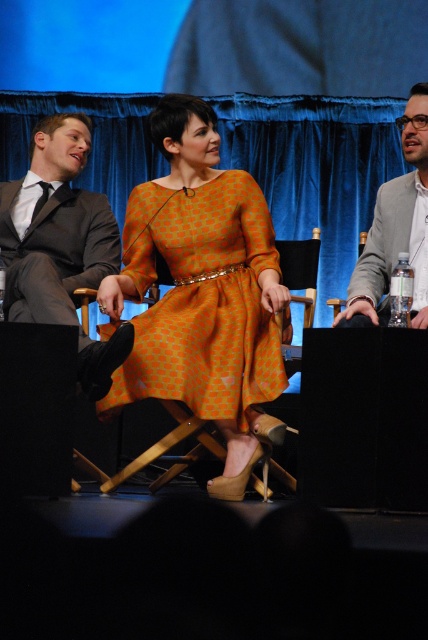
You are an event photographer trying to capture a candid shot of the dark gray suit at left without including the blue velvet curtain at upper center. Is there a way to angle your camera to achieve this?

The blue velvet curtain at upper center is positioned over the dark gray suit at left, so angling the camera downward might allow you to frame the shot to exclude the curtain while focusing on the dark gray suit at left.

You are attending a panel discussion and need to determine the spatial arrangement of the speakers based on their clothing. Which clothing item is positioned higher in the image, the orange printed dress at center or the dark gray suit at left?

The orange printed dress at center is taller than the dark gray suit at left, so the orange printed dress at center is positioned higher in the image.

You are a stagehand preparing to place a 2.0 meter long banner between the blue velvet curtain at upper center and the orange printed dress at center. Based on the space available, will the banner fit without overlapping either object?

The distance between the blue velvet curtain at upper center and the orange printed dress at center is 1.91 meters. Since the banner is 2.0 meters long, it will not fit without overlapping one or both objects.